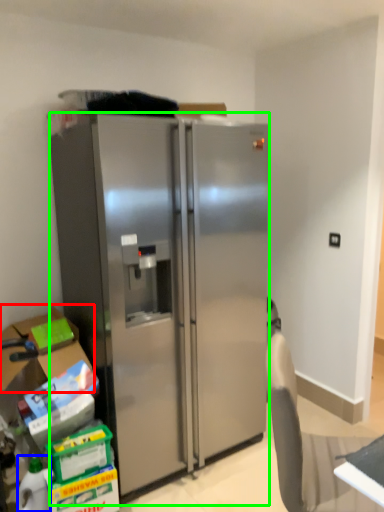
Question: Which is farther away from box (highlighted by a red box)? bottle (highlighted by a blue box) or refrigerator (highlighted by a green box)?

Choices:
 (A) bottle
 (B) refrigerator

Answer: (B)